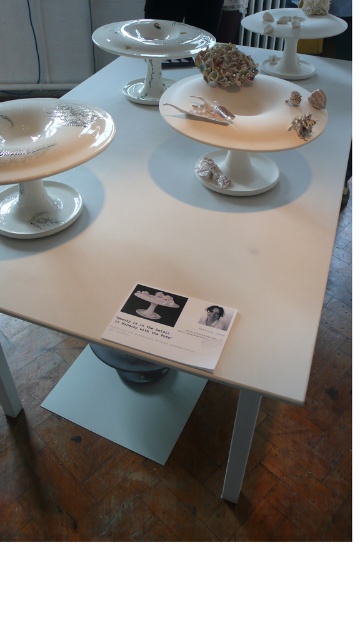
Question: Which object is positioned farthest from the matte white plate at left?

Choices:
 (A) matte white rock at center
 (B) white glossy saucer at center
 (C) bumpy brown food at center
 (D) white glossy saucer at lower left

Answer: (C)

Question: Can you confirm if white glossy table at center is positioned below matte white rock at center?

Choices:
 (A) no
 (B) yes

Answer: (A)

Question: Which of the following is the closest to the observer?

Choices:
 (A) matte white rock at center
 (B) bumpy brown food at center

Answer: (A)

Question: Which object is the farthest from the matte white rock at center?

Choices:
 (A) white glossy saucer at center
 (B) white glossy table at center
 (C) matte porcelain plate at upper center

Answer: (C)

Question: Can you confirm if matte white plate at left is wider than white glossy plate at center?

Choices:
 (A) no
 (B) yes

Answer: (A)

Question: Is white glossy saucer at lower left in front of white glossy saucer at center?

Choices:
 (A) no
 (B) yes

Answer: (B)